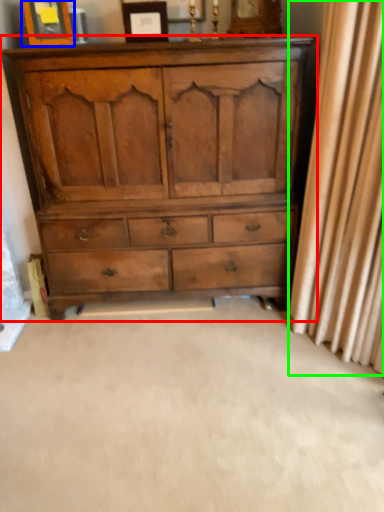
Question: Which object is the closest to the chest of drawers (highlighted by a red box)? Choose among these: picture frame (highlighted by a blue box) or curtain (highlighted by a green box).

Choices:
 (A) picture frame
 (B) curtain

Answer: (B)